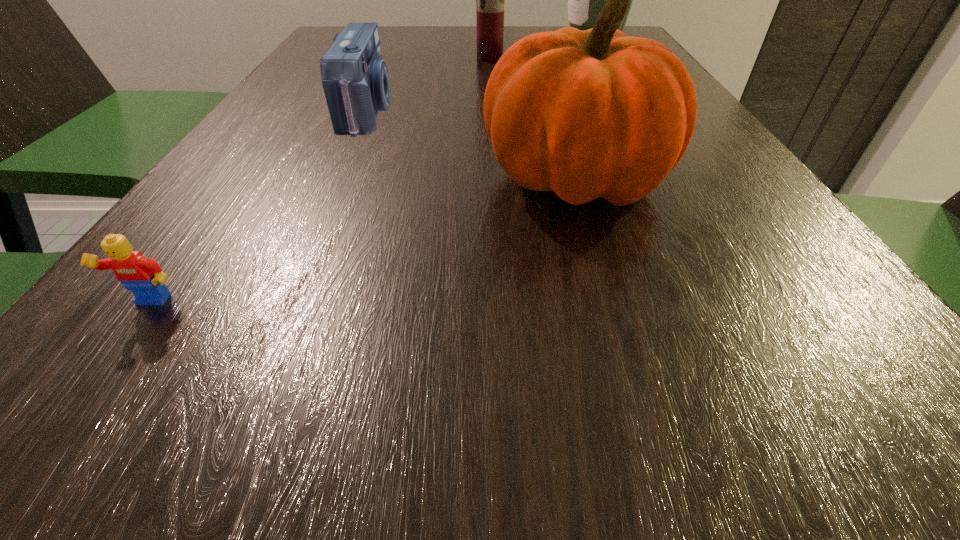
Identify the location of free space between the farthest object and the Lego. (372, 173).

Locate an element on the screen. unoccupied position between the Lego and the pumpkin is located at coordinates (363, 241).

This screenshot has height=540, width=960. Find the location of `object that is the second nearest to the third shortest object`. object that is the second nearest to the third shortest object is located at coordinates (142, 276).

I want to click on object that is the fourth closest to the nearest object, so click(x=585, y=0).

The height and width of the screenshot is (540, 960). What are the coordinates of `free point that satisfies the following two spatial constraints: 1. on the label of the left liquor; 2. on the lens of the second shortest object` in the screenshot? It's located at (492, 111).

At what (x,y) coordinates should I click in order to perform the action: click on vacant space that satisfies the following two spatial constraints: 1. on the lens of the pumpkin; 2. on the right side of the second object from left to right. Please return your answer as a coordinate pair (x, y). The height and width of the screenshot is (540, 960). Looking at the image, I should click on (339, 178).

This screenshot has width=960, height=540. Identify the location of free space in the image that satisfies the following two spatial constraints: 1. on the label of the nearer liquor; 2. on the left side of the pumpkin. tap(495, 178).

Locate an element on the screen. This screenshot has width=960, height=540. free space that satisfies the following two spatial constraints: 1. on the label of the nearer liquor; 2. on the lens of the second object from left to right is located at coordinates (492, 111).

Identify the location of blank space that satisfies the following two spatial constraints: 1. on the lens of the camera; 2. on the left side of the third shortest object. This screenshot has height=540, width=960. (339, 178).

You are a GUI agent. You are given a task and a screenshot of the screen. Output one action in this format:
    pyautogui.click(x=<x>, y=<y>)
    Task: Click on the free space that satisfies the following two spatial constraints: 1. on the front-facing side of the farther liquor; 2. on the face of the shortest object
    Image resolution: width=960 pixels, height=540 pixels.
    Given the screenshot: What is the action you would take?
    pyautogui.click(x=749, y=303)